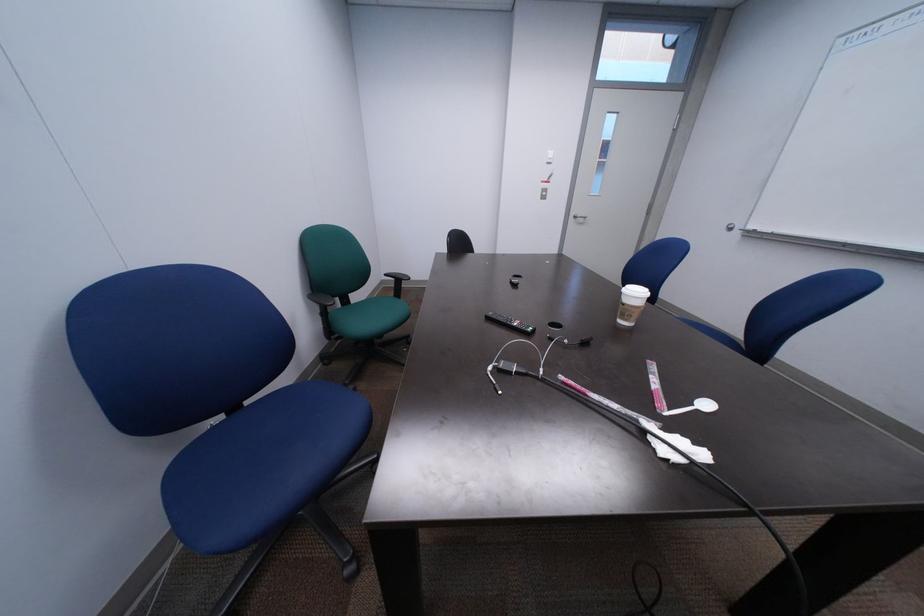
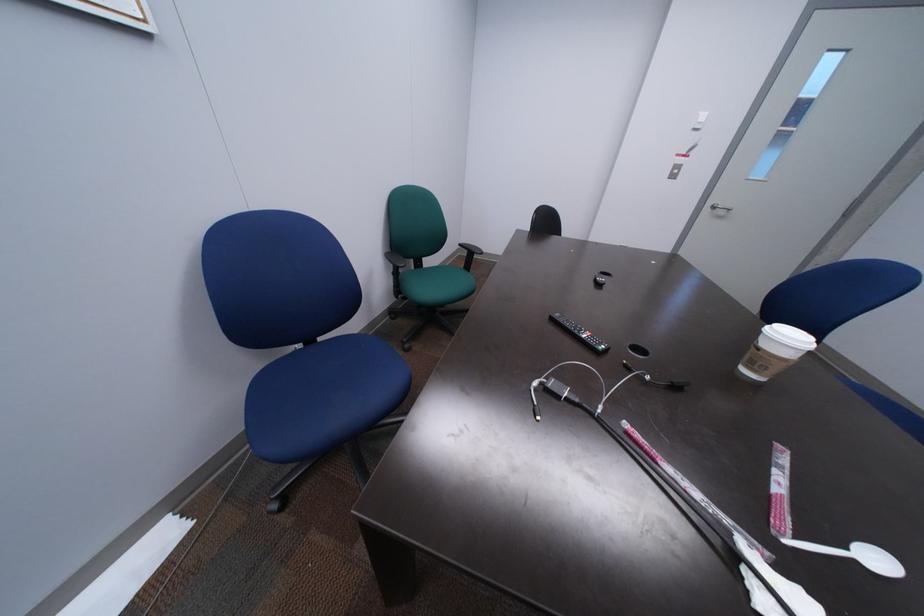
Question: The camera is either moving clockwise (left) or counter-clockwise (right) around the object. The first image is from the beginning of the video and the second image is from the end. Is the camera moving left or right when shooting the video?

Choices:
 (A) Left
 (B) Right

Answer: (B)